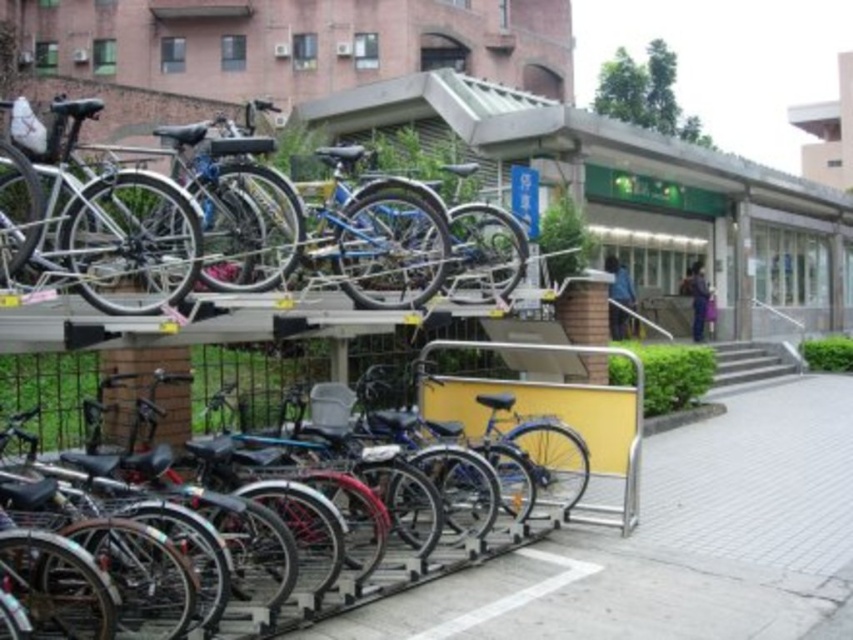
Question: In this image, where is silver metallic bicycle at upper left located relative to metallic silver bicycle at center?

Choices:
 (A) left
 (B) right

Answer: (A)

Question: Among these objects, which one is farthest from the camera?

Choices:
 (A) silver metallic bicycle at upper left
 (B) metallic silver bicycle at center

Answer: (A)

Question: Does silver metallic bicycle at upper left lie in front of metallic silver bicycle at center?

Choices:
 (A) no
 (B) yes

Answer: (A)

Question: Which of the following is the farthest from the observer?

Choices:
 (A) (468, 272)
 (B) (390, 579)

Answer: (A)

Question: Can you confirm if silver metallic bicycle at upper left is positioned to the left of metallic silver bicycle at center?

Choices:
 (A) yes
 (B) no

Answer: (A)